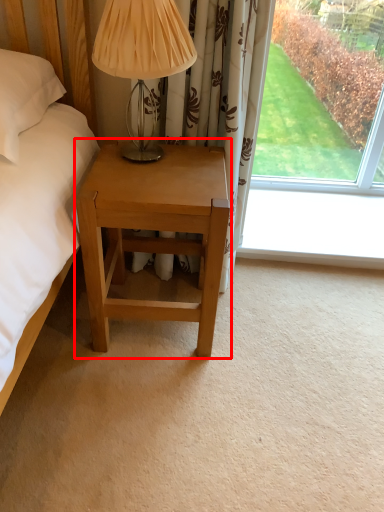
Question: From the image's perspective, what is the correct spatial relationship of nightstand (annotated by the red box) in relation to table lamp?

Choices:
 (A) above
 (B) below

Answer: (B)